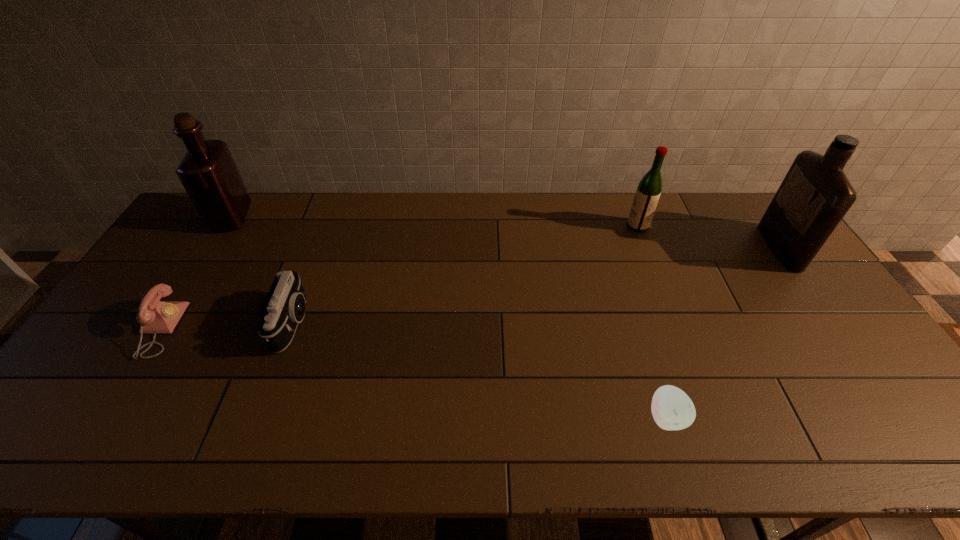
Image resolution: width=960 pixels, height=540 pixels. Identify the location of the rightmost object. (815, 195).

The image size is (960, 540). What are the coordinates of `the leftmost liquor` in the screenshot? It's located at (208, 172).

Identify the location of the second object from right to left. (648, 192).

What are the coordinates of `the shortest liquor` in the screenshot? It's located at (648, 192).

Where is `camera`? Image resolution: width=960 pixels, height=540 pixels. camera is located at coordinates (285, 305).

Where is `the fourth object from right to left`? The width and height of the screenshot is (960, 540). the fourth object from right to left is located at coordinates (285, 305).

The height and width of the screenshot is (540, 960). Find the location of `telephone`. telephone is located at coordinates (155, 316).

Where is `the third object from right to left`? the third object from right to left is located at coordinates (672, 409).

Locate an element on the screen. The width and height of the screenshot is (960, 540). apple is located at coordinates pos(672,409).

Find the location of `vacant region located on the label side of the rightmost liquor`. vacant region located on the label side of the rightmost liquor is located at coordinates (753, 247).